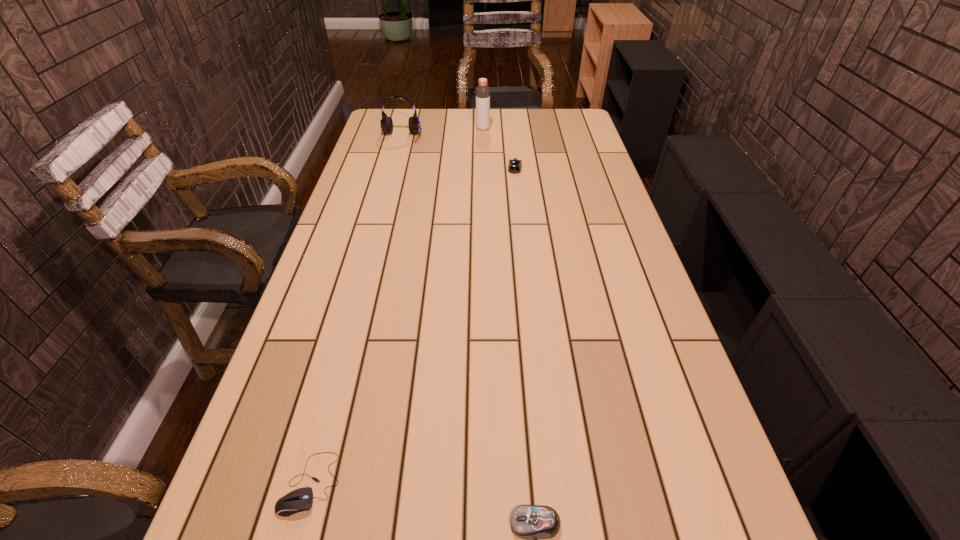
At what (x,y) coordinates should I click in order to perform the action: click on bottle at the far edge. Please return your answer as a coordinate pair (x, y). Looking at the image, I should click on [x=482, y=92].

Where is `headset that is at the far edge`? headset that is at the far edge is located at coordinates (386, 122).

Image resolution: width=960 pixels, height=540 pixels. Identify the location of headset that is at the left edge. pyautogui.click(x=386, y=122).

Where is `computer mouse positioned at the left edge`? computer mouse positioned at the left edge is located at coordinates (299, 500).

Where is `object that is positioned at the far left corner`? The height and width of the screenshot is (540, 960). object that is positioned at the far left corner is located at coordinates point(386,122).

Find the location of a particular element. free space at the far edge is located at coordinates (460, 125).

Identify the location of vacant space at the left edge of the desktop. Image resolution: width=960 pixels, height=540 pixels. (385, 189).

This screenshot has width=960, height=540. In the image, there is a desktop. What are the coordinates of `vacant space at the right edge` in the screenshot? It's located at (612, 212).

Image resolution: width=960 pixels, height=540 pixels. I want to click on vacant space at the far left corner of the desktop, so click(x=374, y=129).

Locate an element on the screen. blank space at the far right corner of the desktop is located at coordinates (581, 113).